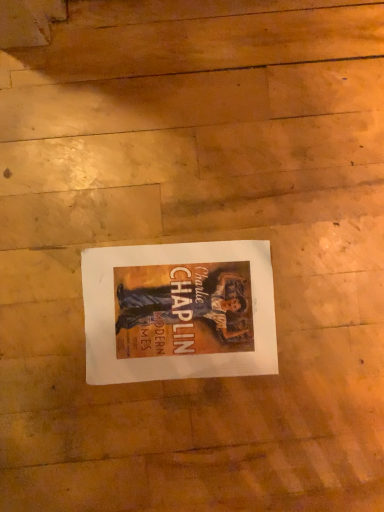
Find the location of a particular element. white paper poster at center is located at coordinates click(x=179, y=311).

What is the approximate height of white paper poster at center?

It is 0.86 inches.

Image resolution: width=384 pixels, height=512 pixels. Describe the element at coordinates (179, 311) in the screenshot. I see `white paper poster at center` at that location.

Identify the location of white paper poster at center. (179, 311).